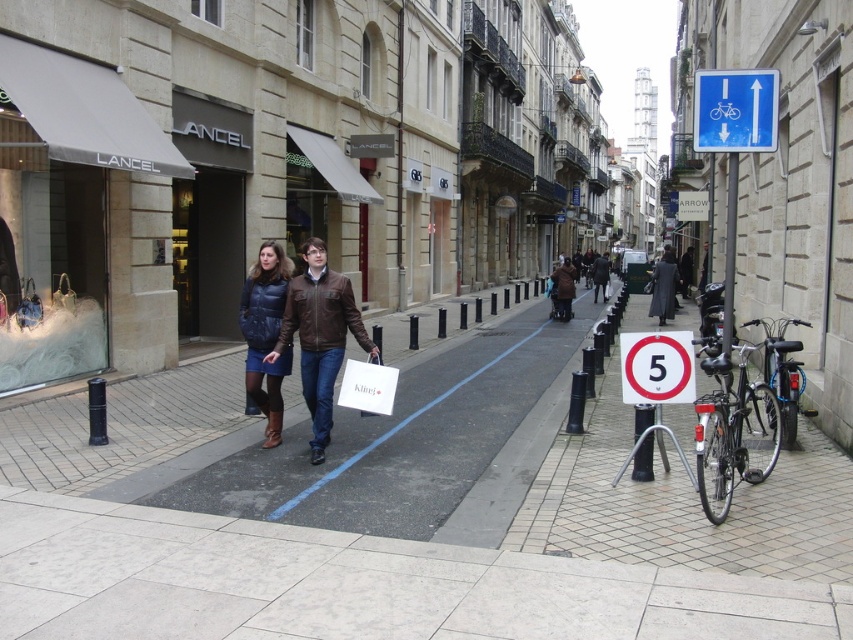
Question: Which of the following is the closest to the observer?

Choices:
 (A) (705, 131)
 (B) (250, 292)
 (C) (566, 268)
 (D) (241, 323)

Answer: (A)

Question: Which object is farther from the camera taking this photo?

Choices:
 (A) white plastic sign at center
 (B) leather jacket at center

Answer: (B)

Question: Is leather jacket at center bigger than blue plastic sign at upper right?

Choices:
 (A) no
 (B) yes

Answer: (B)

Question: Does white plastic sign at center lie in front of brown leather jacket at center?

Choices:
 (A) no
 (B) yes

Answer: (B)

Question: Does matte blue puffer vest at center come in front of brown leather jacket at center?

Choices:
 (A) yes
 (B) no

Answer: (A)

Question: Which of the following is the farthest from the observer?

Choices:
 (A) brown leather jacket at center
 (B) leather jacket at center
 (C) white plastic sign at center
 (D) matte blue puffer vest at center

Answer: (A)